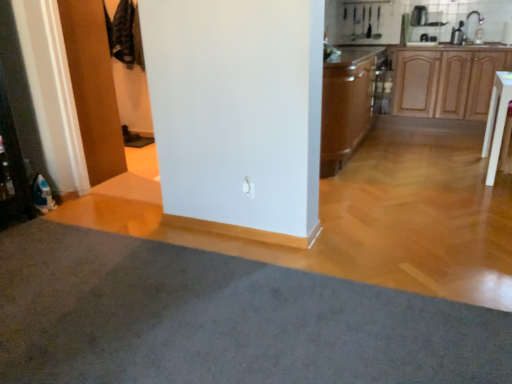
Identify the location of wooden door at left. (93, 87).

Consider the image. What is the approximate width of brown wood cabinet at center, positioned as the first cabinetry in left-to-right order?

22.39 inches.

Identify the location of wooden cabinet at right, the 1th cabinetry in the right-to-left sequence. (447, 82).

At what (x,y) coordinates should I click in order to perform the action: click on wooden at upper right. Please return your answer as a coordinate pair (x, y). Looking at the image, I should click on (349, 54).

Where is `white glossy sink at upper right`? The width and height of the screenshot is (512, 384). white glossy sink at upper right is located at coordinates (470, 30).

Where is `white glossy table at upper right`? white glossy table at upper right is located at coordinates (496, 122).

Describe the element at coordinates (496, 122) in the screenshot. I see `white glossy table at upper right` at that location.

Locate an element on the screen. wooden door at left is located at coordinates (93, 87).

Locate an element on the screen. Image resolution: width=512 pixels, height=384 pixels. countertop on the right side of wooden door at left is located at coordinates (349, 54).

Do you think wooden door at left is within wooden at upper right, or outside of it?

The correct answer is: outside.

Between wooden door at left and wooden at upper right, which one appears on the left side from the viewer's perspective?

From the viewer's perspective, wooden door at left appears more on the left side.

Does point (70, 15) appear closer or farther from the camera than point (353, 63)?

Clearly, point (70, 15) is closer to the camera than point (353, 63).

Is gray carpet at lower left oriented towards white glossy sink at upper right?

No, gray carpet at lower left is not facing towards white glossy sink at upper right.

Based on the photo, how many degrees apart are the facing directions of gray carpet at lower left and white glossy sink at upper right?

179 degrees.

From the image's perspective, is gray carpet at lower left under white glossy sink at upper right?

Correct, gray carpet at lower left appears lower than white glossy sink at upper right in the image.

In the scene shown: Which of these two, gray carpet at lower left or white glossy sink at upper right, stands shorter?

Standing shorter between the two is gray carpet at lower left.

Based on the photo, between wooden door at left and white glossy table at upper right, which one appears on the left side from the viewer's perspective?

From the viewer's perspective, wooden door at left appears more on the left side.

Is wooden door at left aimed at white glossy table at upper right?

No, wooden door at left is not facing towards white glossy table at upper right.

Would you say white glossy table at upper right is part of wooden door at left's contents?

Actually, white glossy table at upper right is outside wooden door at left.

In the scene shown: Relative to white glossy table at upper right, is wooden door at left in front or behind?

In the image, wooden door at left appears in front of white glossy table at upper right.

Is wooden cabinet at right, the 1th cabinetry in the right-to-left sequence, completely or partially outside of brown wood cabinet at center, positioned as the 2th cabinetry in right-to-left order?

wooden cabinet at right, the 1th cabinetry in the right-to-left sequence, lies outside brown wood cabinet at center, positioned as the 2th cabinetry in right-to-left order,'s area.

Is wooden cabinet at right, the 1th cabinetry in the right-to-left sequence, bigger or smaller than brown wood cabinet at center, positioned as the 2th cabinetry in right-to-left order?

In the image, wooden cabinet at right, the 1th cabinetry in the right-to-left sequence, appears to be larger than brown wood cabinet at center, positioned as the 2th cabinetry in right-to-left order.

Which of these two, wooden cabinet at right, which is the second cabinetry in left-to-right order, or brown wood cabinet at center, positioned as the first cabinetry in left-to-right order, is thinner?

brown wood cabinet at center, positioned as the first cabinetry in left-to-right order, is thinner.

What's the angular difference between wooden cabinet at right, the 1th cabinetry in the right-to-left sequence, and brown wood cabinet at center, positioned as the first cabinetry in left-to-right order,'s facing directions?

The facing directions of wooden cabinet at right, the 1th cabinetry in the right-to-left sequence, and brown wood cabinet at center, positioned as the first cabinetry in left-to-right order, are 90 degrees apart.

Would you say gray carpet at lower left is part of wooden door at left's contents?

Actually, gray carpet at lower left is outside wooden door at left.

Considering the sizes of objects wooden door at left and gray carpet at lower left in the image provided, who is wider, wooden door at left or gray carpet at lower left?

With larger width is gray carpet at lower left.

From the image's perspective, who appears lower, wooden door at left or gray carpet at lower left?

From the image's view, gray carpet at lower left is below.

Which object is closer to the camera taking this photo, wooden door at left or gray carpet at lower left?

gray carpet at lower left is closer to the camera.

Which of these two, wooden door at left or wooden cabinet at right, which is the second cabinetry in left-to-right order, is bigger?

With larger size is wooden cabinet at right, which is the second cabinetry in left-to-right order.

Is wooden door at left far from wooden cabinet at right, the 1th cabinetry in the right-to-left sequence?

Yes, wooden door at left and wooden cabinet at right, the 1th cabinetry in the right-to-left sequence, are located far from each other.

Could you tell me if wooden door at left is facing wooden cabinet at right, which is the second cabinetry in left-to-right order?

No, wooden door at left is not turned towards wooden cabinet at right, which is the second cabinetry in left-to-right order.

Looking at this image, from a real-world perspective, who is located lower, wooden door at left or wooden cabinet at right, which is the second cabinetry in left-to-right order?

wooden cabinet at right, which is the second cabinetry in left-to-right order, from a real-world perspective.

Looking at this image, do you think white glossy sink at upper right is within wooden at upper right, or outside of it?

white glossy sink at upper right cannot be found inside wooden at upper right.

Which of these two, white glossy sink at upper right or wooden at upper right, is bigger?

With larger size is wooden at upper right.

Does white glossy sink at upper right come behind wooden at upper right?

Yes, the depth of white glossy sink at upper right is greater than that of wooden at upper right.

This screenshot has height=384, width=512. I want to click on countertop behind the wooden door at left, so click(349, 54).

Identify the location of sink located above the gray carpet at lower left (from the image's perspective). The image size is (512, 384). (470, 30).

Based on their spatial positions, is brown wood cabinet at center, positioned as the first cabinetry in left-to-right order, or wooden cabinet at right, which is the second cabinetry in left-to-right order, closer to wooden at upper right?

brown wood cabinet at center, positioned as the first cabinetry in left-to-right order, is positioned closer to the anchor wooden at upper right.

When comparing their distances from white glossy table at upper right, does wooden cabinet at right, which is the second cabinetry in left-to-right order, or wooden door at left seem further?

wooden door at left is further to white glossy table at upper right.

When comparing their distances from wooden door at left, does wooden at upper right or white glossy table at upper right seem closer?

Based on the image, wooden at upper right appears to be nearer to wooden door at left.

Based on their spatial positions, is wooden at upper right or gray carpet at lower left closer to white glossy sink at upper right?

Based on the image, wooden at upper right appears to be nearer to white glossy sink at upper right.

Considering their positions, is white glossy table at upper right positioned further to brown wood cabinet at center, positioned as the 2th cabinetry in right-to-left order, than wooden at upper right?

white glossy table at upper right lies further to brown wood cabinet at center, positioned as the 2th cabinetry in right-to-left order, than the other object.

When comparing their distances from gray carpet at lower left, does white glossy table at upper right or wooden cabinet at right, which is the second cabinetry in left-to-right order, seem further?

Among the two, wooden cabinet at right, which is the second cabinetry in left-to-right order, is located further to gray carpet at lower left.

Based on their spatial positions, is white glossy sink at upper right or wooden at upper right closer to gray carpet at lower left?

wooden at upper right.

Which object lies further to the anchor point brown wood cabinet at center, positioned as the first cabinetry in left-to-right order, wooden at upper right or white glossy table at upper right?

white glossy table at upper right is further to brown wood cabinet at center, positioned as the first cabinetry in left-to-right order.

Image resolution: width=512 pixels, height=384 pixels. Identify the location of countertop between gray carpet at lower left and wooden cabinet at right, the 1th cabinetry in the right-to-left sequence, in the front-back direction. (349, 54).

The image size is (512, 384). In order to click on countertop located between wooden door at left and wooden cabinet at right, the 1th cabinetry in the right-to-left sequence, in the left-right direction in this screenshot , I will do `click(349, 54)`.

Locate an element on the screen. This screenshot has width=512, height=384. plain located between wooden door at left and white glossy table at upper right in the left-right direction is located at coordinates (221, 319).

Locate an element on the screen. This screenshot has width=512, height=384. cabinetry between wooden door at left and wooden cabinet at right, the 1th cabinetry in the right-to-left sequence is located at coordinates (346, 104).